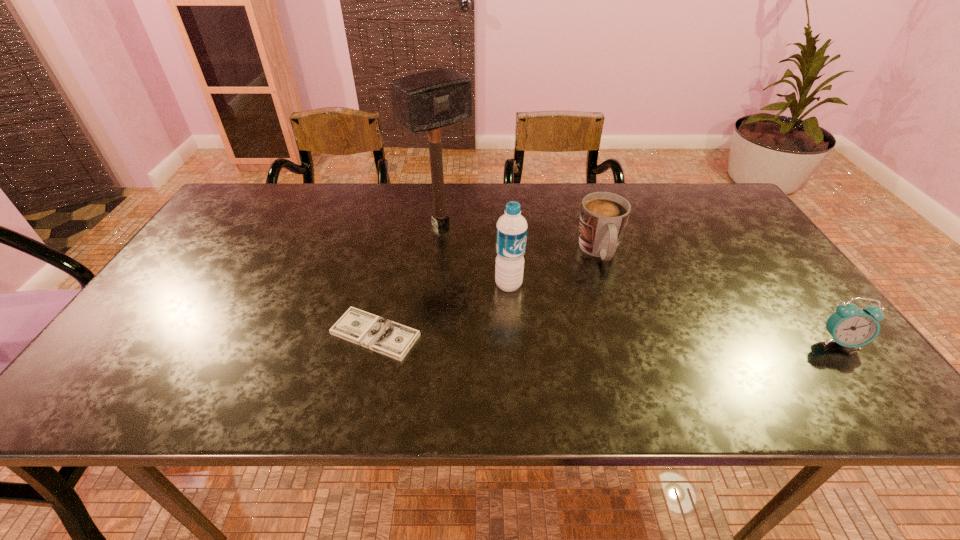
Image resolution: width=960 pixels, height=540 pixels. I want to click on blank area located 0.080m on the label of the third farthest object, so click(x=542, y=309).

Find the location of a particular element. This screenshot has width=960, height=540. vacant space situated on the label of the third farthest object is located at coordinates (587, 340).

Locate an element on the screen. The image size is (960, 540). vacant area situated 0.090m on the label of the third farthest object is located at coordinates (546, 312).

Identify the location of free space located 0.250m on the head of the mallet. This screenshot has height=540, width=960. (512, 286).

Image resolution: width=960 pixels, height=540 pixels. I want to click on free space located 0.070m on the head of the mallet, so tap(471, 249).

The image size is (960, 540). Find the location of `free point located 0.250m on the head of the mallet`. free point located 0.250m on the head of the mallet is located at coordinates (512, 286).

Identify the location of object situated at the far edge. (427, 101).

Where is `dollar that is at the near edge`? Image resolution: width=960 pixels, height=540 pixels. dollar that is at the near edge is located at coordinates (387, 337).

Locate an element on the screen. alarm clock at the near edge is located at coordinates (850, 326).

Locate an element on the screen. This screenshot has height=540, width=960. object present at the right edge is located at coordinates (850, 326).